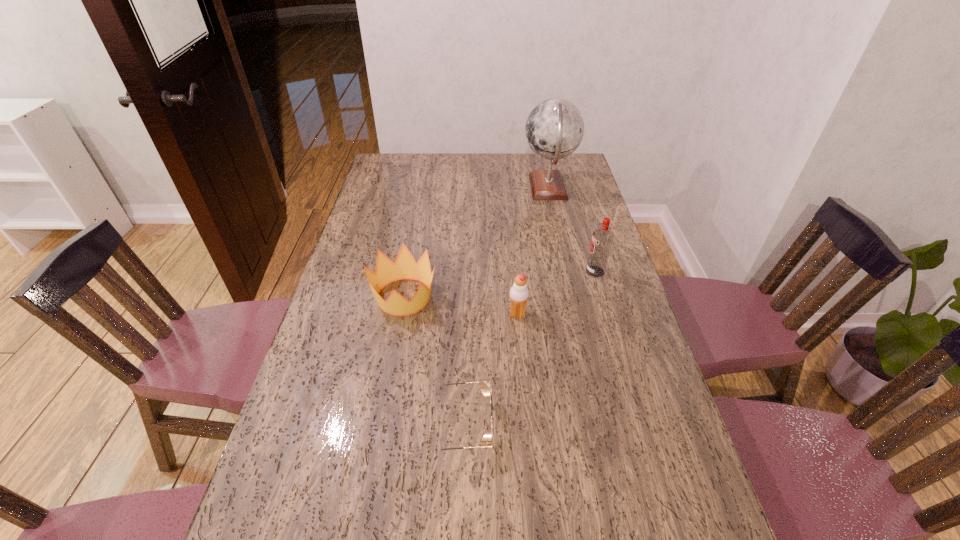
You are a GUI agent. You are given a task and a screenshot of the screen. Output one action in this format:
    pyautogui.click(x=<x>, y=<y>)
    Task: Click on the vacant space in between the vodka and the third object from right to left
    The image size is (960, 540).
    Given the screenshot: What is the action you would take?
    pyautogui.click(x=557, y=293)

In order to click on free point between the farthest object and the icecream in this screenshot , I will do `click(533, 251)`.

The image size is (960, 540). Find the location of `free space between the nearest object and the fourth tallest object`. free space between the nearest object and the fourth tallest object is located at coordinates (432, 361).

In order to click on vacant area that lies between the crown and the icecream in this screenshot , I will do `click(461, 306)`.

Where is `empty space between the third shortest object and the vodka`? empty space between the third shortest object and the vodka is located at coordinates (557, 293).

Locate which object ranks in proximity to the crown. Please provide its 2D coordinates. Your answer should be formatted as a tuple, i.e. [(x, y)], where the tuple contains the x and y coordinates of a point satisfying the conditions above.

[(519, 293)]

Select which object appears as the fourth closest to the icecream. Please provide its 2D coordinates. Your answer should be formatted as a tuple, i.e. [(x, y)], where the tuple contains the x and y coordinates of a point satisfying the conditions above.

[(554, 129)]